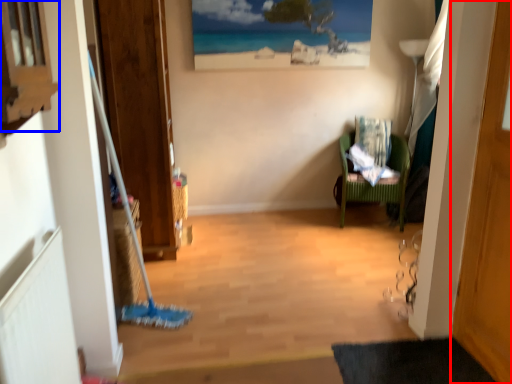
Question: Which object appears closest to the camera in this image, door (highlighted by a red box) or window (highlighted by a blue box)?

Choices:
 (A) door
 (B) window

Answer: (B)